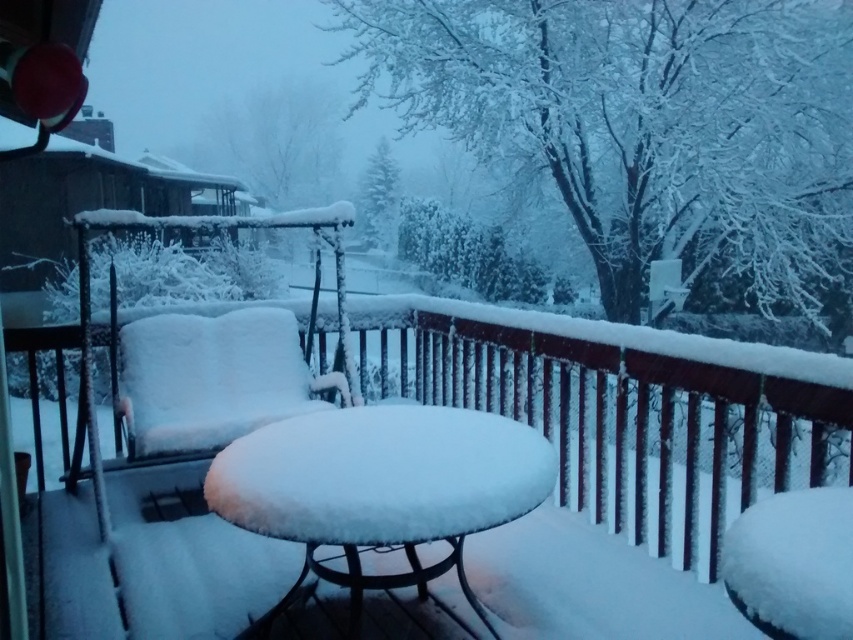
Question: Considering the relative positions of white snow-covered table at center and white fluffy cushion at center in the image provided, where is white snow-covered table at center located with respect to white fluffy cushion at center?

Choices:
 (A) right
 (B) left

Answer: (A)

Question: Does white snow-covered table at center have a lesser width compared to white fluffy cushion at center?

Choices:
 (A) no
 (B) yes

Answer: (B)

Question: Which of the following is the farthest from the observer?

Choices:
 (A) white snow-covered table at center
 (B) white fluffy cushion at center

Answer: (B)

Question: Is white snow-covered table at center behind white fluffy cushion at center?

Choices:
 (A) no
 (B) yes

Answer: (A)